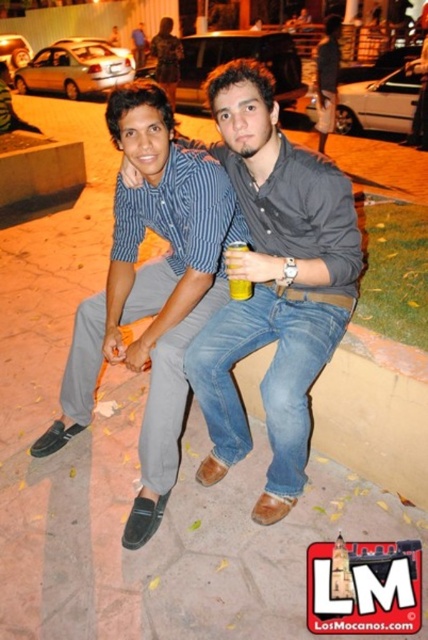
Question: Which of the following is the farthest from the observer?

Choices:
 (A) (232, 285)
 (B) (332, 282)
 (C) (142, 307)

Answer: (C)

Question: Which of the following is the farthest from the observer?

Choices:
 (A) (166, 449)
 (B) (264, 93)
 (C) (240, 284)

Answer: (A)

Question: Which object is farther from the camera taking this photo?

Choices:
 (A) blue jeans at center
 (B) matte blue shirt at center

Answer: (B)

Question: Is matte blue shirt at center above yellow plastic cup at center?

Choices:
 (A) no
 (B) yes

Answer: (A)

Question: Is blue jeans at center above yellow plastic cup at center?

Choices:
 (A) no
 (B) yes

Answer: (A)

Question: Is the position of matte blue shirt at center less distant than that of yellow plastic cup at center?

Choices:
 (A) yes
 (B) no

Answer: (B)